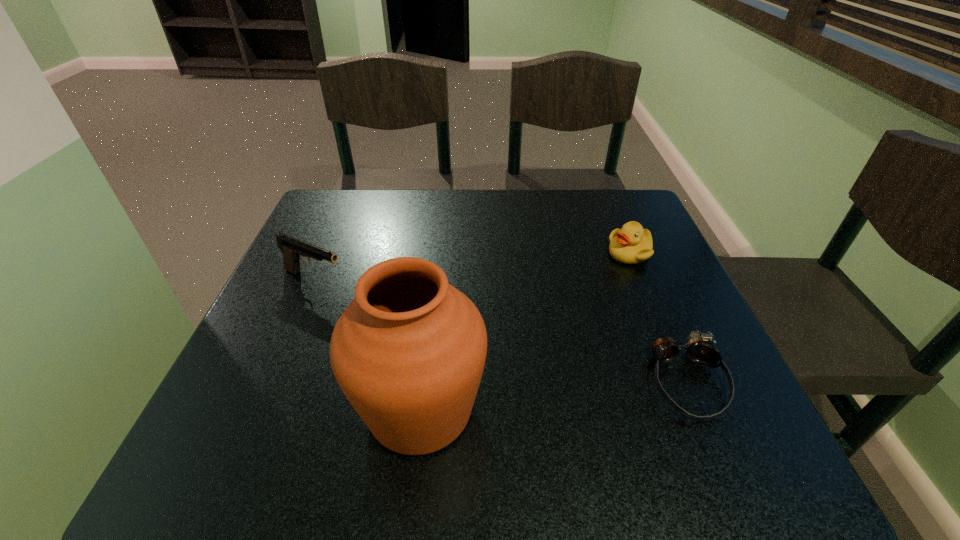
This screenshot has width=960, height=540. Find the location of `object that is at the near right corner`. object that is at the near right corner is located at coordinates (700, 350).

Where is `free space at the far edge of the desktop`? free space at the far edge of the desktop is located at coordinates (413, 192).

Locate an element on the screen. The height and width of the screenshot is (540, 960). vacant space at the left edge of the desktop is located at coordinates (296, 371).

The width and height of the screenshot is (960, 540). Identify the location of vacant space at the right edge. (665, 259).

The height and width of the screenshot is (540, 960). What are the coordinates of `blank area at the far left corner` in the screenshot? It's located at (358, 214).

Locate an element on the screen. The height and width of the screenshot is (540, 960). free space at the far right corner of the desktop is located at coordinates (594, 200).

The image size is (960, 540). I want to click on free space between the third tallest object and the urn, so click(525, 331).

Where is `vacant region between the tallest object and the third tallest object`? This screenshot has width=960, height=540. vacant region between the tallest object and the third tallest object is located at coordinates (525, 331).

At what (x,y) coordinates should I click in order to perform the action: click on vacant area between the second shortest object and the tallest object. Please return your answer as a coordinate pair (x, y). This screenshot has width=960, height=540. Looking at the image, I should click on (525, 331).

You are a GUI agent. You are given a task and a screenshot of the screen. Output one action in this format:
    pyautogui.click(x=<x>, y=<y>)
    Task: Click on the unoccupied area between the third object from right to left and the duckling
    This screenshot has width=960, height=540.
    Given the screenshot: What is the action you would take?
    pyautogui.click(x=525, y=331)